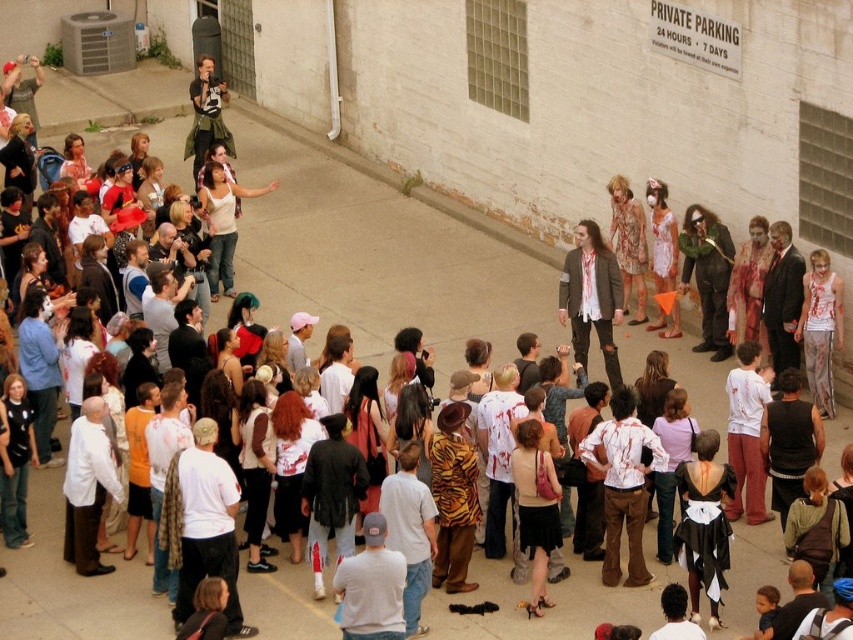
You are standing at the entrance of the alleyway and want to find the green fuzzy coat at center. According to the coordinates provided, in which direction should you look to locate it?

The green fuzzy coat at center is located at coordinates point (x=706, y=275), which means it is positioned slightly to the left and lower center of the alleyway. You should look towards the lower central area near the left side to find it.